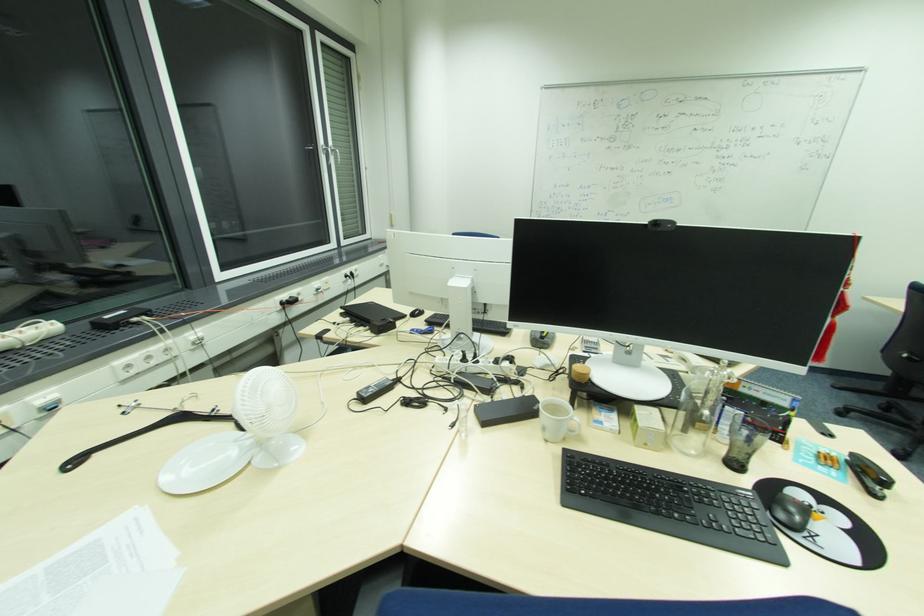
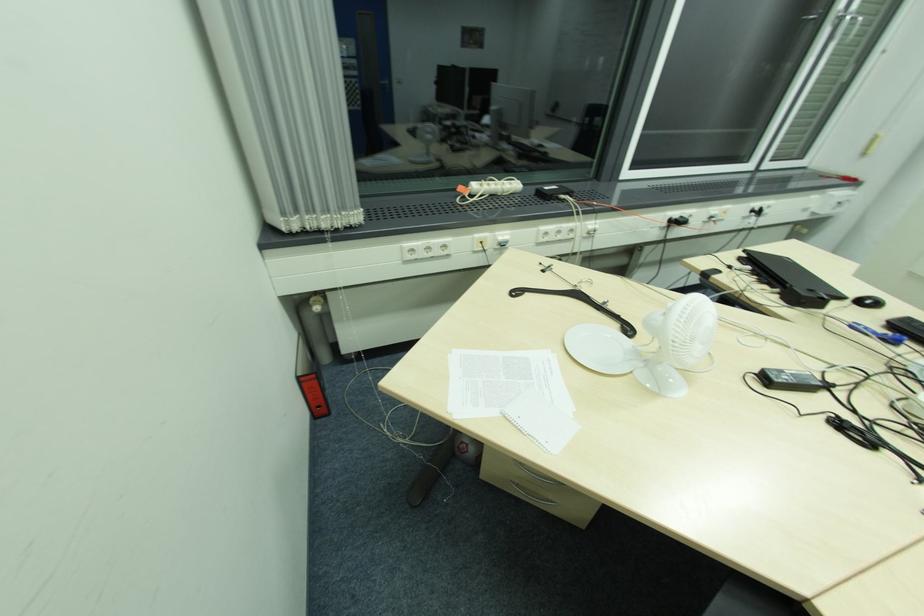
From the picture: First-person continuous shooting, in which direction is the camera rotating?

The camera rotated toward left-down.